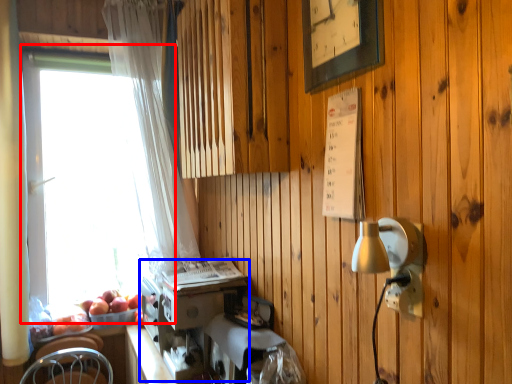
Question: Which object is further to the camera taking this photo, window (highlighted by a red box) or coffee machine (highlighted by a blue box)?

Choices:
 (A) window
 (B) coffee machine

Answer: (A)